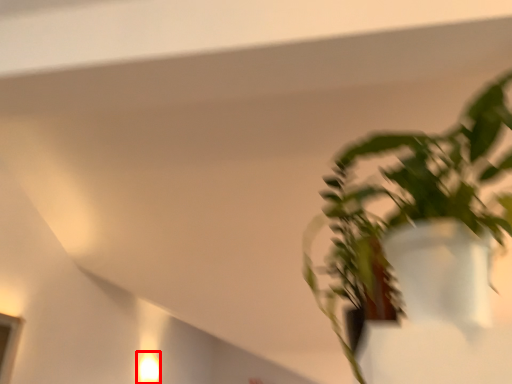
Question: From the image's perspective, what is the correct spatial relationship of light fixture (annotated by the red box) in relation to houseplant?

Choices:
 (A) above
 (B) below

Answer: (B)